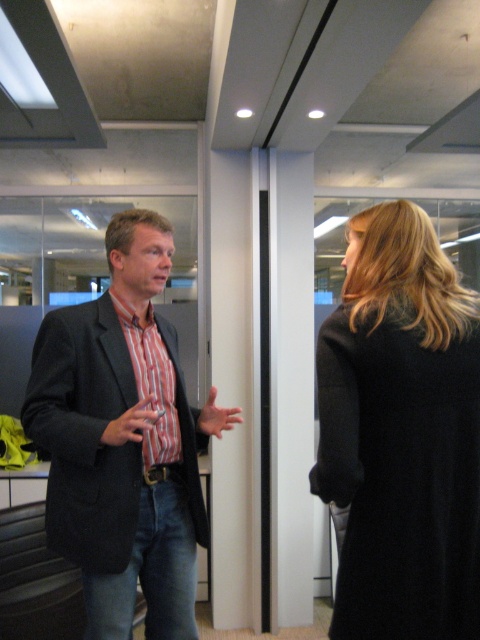
Who is lower down, black wool coat at right or striped cotton shirt at center?

striped cotton shirt at center is lower down.

From the picture: Can you confirm if black wool coat at right is positioned to the right of striped cotton shirt at center?

Correct, you'll find black wool coat at right to the right of striped cotton shirt at center.

Locate an element on the screen. Image resolution: width=480 pixels, height=640 pixels. black wool coat at right is located at coordinates (402, 433).

Image resolution: width=480 pixels, height=640 pixels. Find the location of `black wool coat at right`. black wool coat at right is located at coordinates (402, 433).